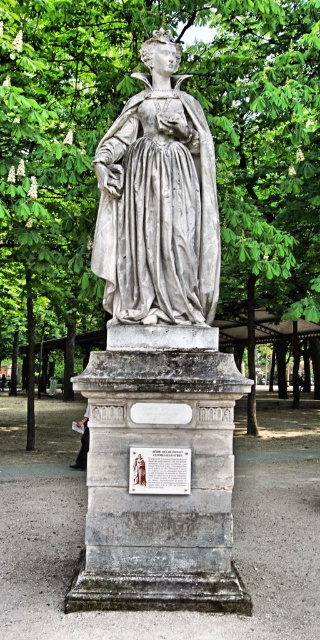
Is gray marble statue at center to the right of black leather jacket at lower left from the viewer's perspective?

Correct, you'll find gray marble statue at center to the right of black leather jacket at lower left.

Between gray marble statue at center and black leather jacket at lower left, which one is positioned lower?

Positioned lower is black leather jacket at lower left.

Between point (174, 147) and point (71, 467), which one is positioned behind?

Point (71, 467)

I want to click on gray marble statue at center, so click(158, 202).

Based on the photo, measure the distance between white marble statue at center and white stone plaque at center.

white marble statue at center is 32.87 inches away from white stone plaque at center.

The height and width of the screenshot is (640, 320). I want to click on white marble statue at center, so click(159, 360).

Which is behind, point (144, 529) or point (166, 461)?

Positioned behind is point (166, 461).

You are a GUI agent. You are given a task and a screenshot of the screen. Output one action in this format:
    pyautogui.click(x=<x>, y=<y>)
    Task: Click on the white marble statue at center
    This screenshot has height=640, width=320.
    Given the screenshot: What is the action you would take?
    pyautogui.click(x=159, y=360)

Is white marble statue at center closer to the viewer compared to gray marble statue at center?

Yes, it is in front of gray marble statue at center.

Is white marble statue at center to the left of gray marble statue at center from the viewer's perspective?

→ Indeed, white marble statue at center is positioned on the left side of gray marble statue at center.

Which is in front, point (194, 138) or point (167, 257)?

Point (167, 257) is more forward.

This screenshot has height=640, width=320. What are the coordinates of `white marble statue at center` in the screenshot? It's located at (159, 360).